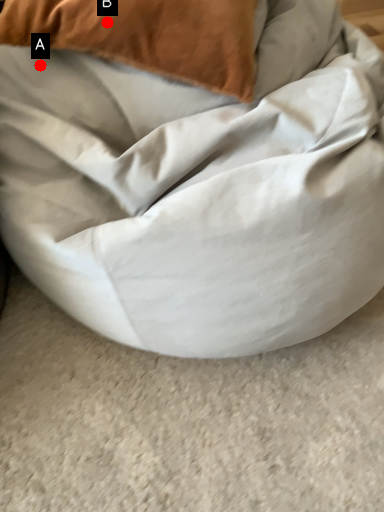
Question: Two points are circled on the image, labeled by A and B beside each circle. Which of the following is the farthest from the observer?

Choices:
 (A) A is further
 (B) B is further

Answer: (A)